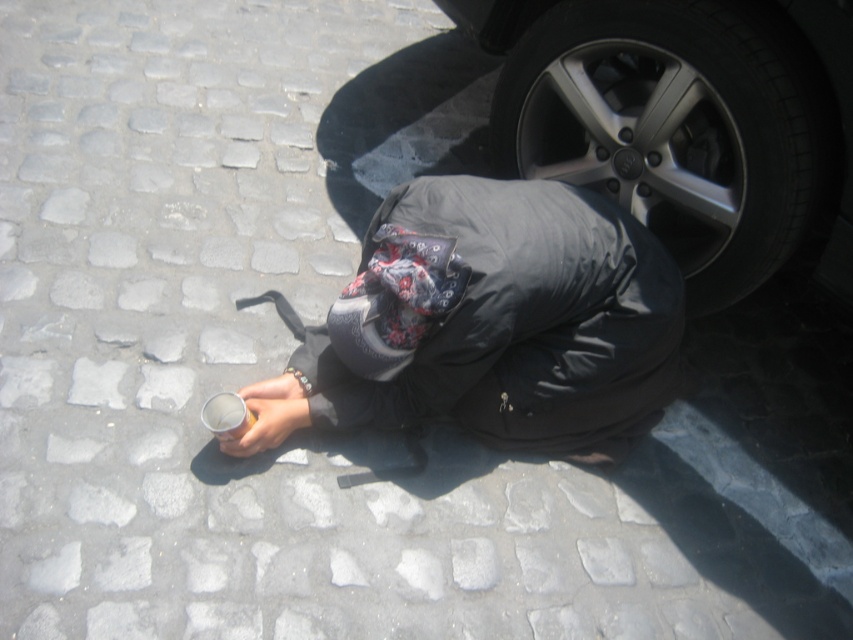
Can you confirm if silver metallic tire at lower right is positioned to the right of clear plastic cup at lower left?

Indeed, silver metallic tire at lower right is positioned on the right side of clear plastic cup at lower left.

Does point (663, 140) come closer to viewer compared to point (235, 432)?

No.

Find the location of a particular element. Image resolution: width=853 pixels, height=640 pixels. silver metallic tire at lower right is located at coordinates (677, 128).

Can you confirm if metallic can at center is positioned to the left of clear plastic cup at lower left?

Incorrect, metallic can at center is not on the left side of clear plastic cup at lower left.

Which is more to the left, metallic can at center or clear plastic cup at lower left?

From the viewer's perspective, clear plastic cup at lower left appears more on the left side.

Does point (593, 301) come closer to viewer compared to point (241, 416)?

Yes, it is in front of point (241, 416).

Identify the location of metallic can at center. (491, 324).

Can you confirm if metallic can at center is wider than silver metallic tire at lower right?

Yes, metallic can at center is wider than silver metallic tire at lower right.

Find the location of a particular element. The image size is (853, 640). metallic can at center is located at coordinates (491, 324).

Which is behind, point (366, 289) or point (766, 198)?

The point (766, 198) is behind.

What are the coordinates of `metallic can at center` in the screenshot? It's located at (491, 324).